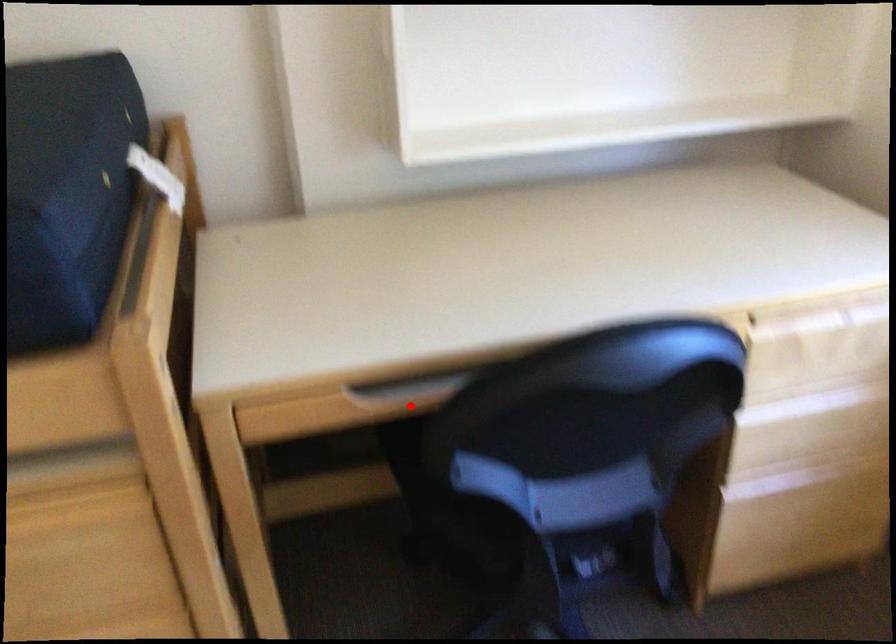
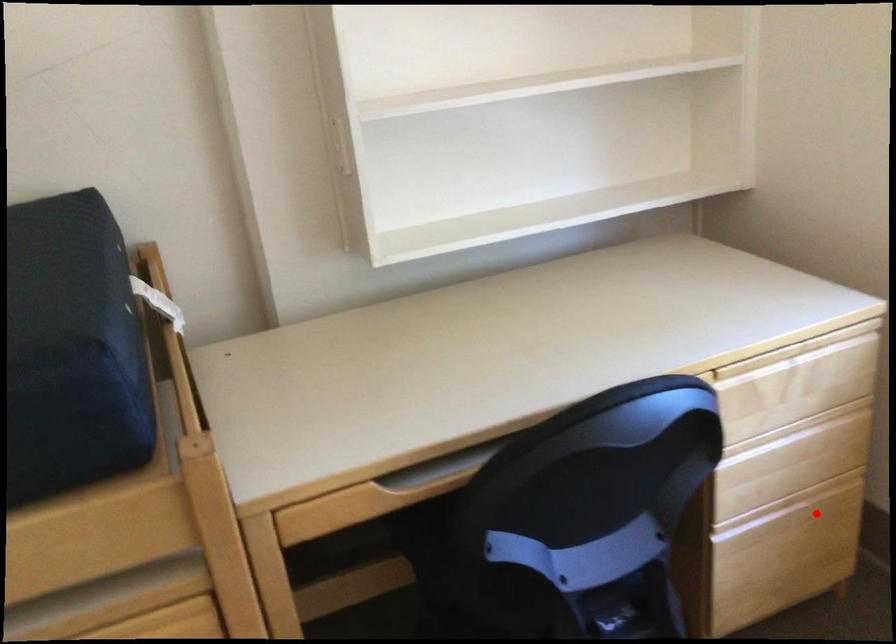
I am providing you with two images of the same scene from different viewpoints. A red point is marked on the first image and another point is marked on the second image. Are the points marked in image1 and image2 representing the same 3D position?

No